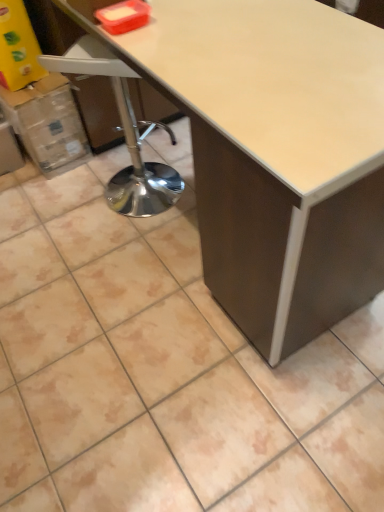
At what (x,y) coordinates should I click in order to perform the action: click on white plastic swivel chair at left. Please return your answer as a coordinate pair (x, y). Looking at the image, I should click on (124, 133).

I want to click on cardboard box at left, so click(x=47, y=124).

Is cardboard box at left surrounded by white plastic swivel chair at left?

No.

From the image's perspective, is white plastic swivel chair at left beneath cardboard box at left?

Yes, from the image's perspective, white plastic swivel chair at left is beneath cardboard box at left.

I want to click on cardboard box below the white plastic swivel chair at left (from a real-world perspective), so click(x=47, y=124).

Would you consider white plastic swivel chair at left to be distant from cardboard box at left?

No, white plastic swivel chair at left is not far from cardboard box at left.

Find the location of a particular element. This screenshot has width=384, height=512. cardboard box above the matte white table at center (from the image's perspective) is located at coordinates (47, 124).

From a real-world perspective, is cardboard box at left physically located above or below matte white table at center?

From a real-world perspective, cardboard box at left is physically below matte white table at center.

Based on their sizes in the image, would you say cardboard box at left is bigger or smaller than matte white table at center?

Clearly, cardboard box at left is smaller in size than matte white table at center.

Which is closer, (28, 89) or (361, 205)?

Positioned in front is point (361, 205).

Is white plastic swivel chair at left with matte white table at center?

No, white plastic swivel chair at left is not touching matte white table at center.

How many degrees apart are the facing directions of white plastic swivel chair at left and matte white table at center?

They differ by 128 degrees in their facing directions.

Is matte white table at center at the back of white plastic swivel chair at left?

Yes, matte white table at center is at the back of white plastic swivel chair at left.

Which of these two, white plastic swivel chair at left or matte white table at center, stands taller?

matte white table at center is taller.

At what (x,y) coordinates should I click in order to perform the action: click on swivel chair on the left of matte white table at center. Please return your answer as a coordinate pair (x, y). The width and height of the screenshot is (384, 512). Looking at the image, I should click on (124, 133).

Between matte white table at center and white plastic swivel chair at left, which one is positioned in front?

matte white table at center is closer to the camera.

Looking at this image, is matte white table at center wider or thinner than white plastic swivel chair at left?

matte white table at center is wider than white plastic swivel chair at left.

Looking at this image, can we say matte white table at center lies outside white plastic swivel chair at left?

Yes.

Which object is wider, cardboard box at left or white plastic swivel chair at left?

Wider between the two is cardboard box at left.

Is cardboard box at left oriented away from white plastic swivel chair at left?

No, cardboard box at left is not facing away from white plastic swivel chair at left.

Is cardboard box at left shorter than white plastic swivel chair at left?

Correct, cardboard box at left is not as tall as white plastic swivel chair at left.

Can you confirm if matte white table at center is positioned to the right of cardboard box at left?

Correct, you'll find matte white table at center to the right of cardboard box at left.

Could you tell me if matte white table at center is turned towards cardboard box at left?

No, matte white table at center is not facing towards cardboard box at left.

Is point (358, 237) behind point (63, 99)?

No, it is in front of (63, 99).

Image resolution: width=384 pixels, height=512 pixels. Identify the location of cardboard box below the white plastic swivel chair at left (from a real-world perspective). (47, 124).

At what (x,y) coordinates should I click in order to perform the action: click on table below the cardboard box at left (from the image's perspective). Please return your answer as a coordinate pair (x, y). The width and height of the screenshot is (384, 512). Looking at the image, I should click on (275, 154).

Which object lies nearer to the anchor point cardboard box at left, matte white table at center or white plastic swivel chair at left?

Based on the image, white plastic swivel chair at left appears to be nearer to cardboard box at left.

When comparing their distances from cardboard box at left, does white plastic swivel chair at left or matte white table at center seem closer?

Among the two, white plastic swivel chair at left is located nearer to cardboard box at left.

Estimate the real-world distances between objects in this image. Which object is closer to matte white table at center, cardboard box at left or white plastic swivel chair at left?

white plastic swivel chair at left is positioned closer to the anchor matte white table at center.

From the image, which object appears to be farther from white plastic swivel chair at left, cardboard box at left or matte white table at center?

matte white table at center is further to white plastic swivel chair at left.

Which object lies further to the anchor point white plastic swivel chair at left, matte white table at center or cardboard box at left?

matte white table at center.

Based on their spatial positions, is white plastic swivel chair at left or cardboard box at left further from matte white table at center?

Based on the image, cardboard box at left appears to be further to matte white table at center.

At what (x,y) coordinates should I click in order to perform the action: click on swivel chair positioned between matte white table at center and cardboard box at left from near to far. Please return your answer as a coordinate pair (x, y). Looking at the image, I should click on (124, 133).